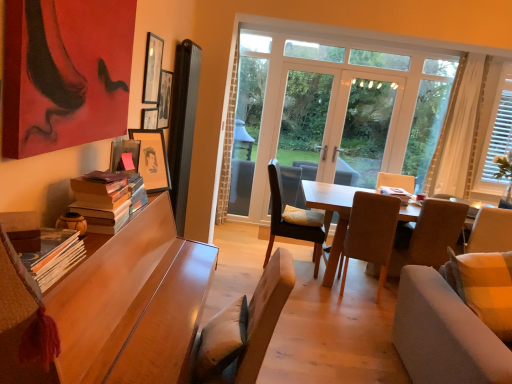
Question: Considering the relative positions of hardcover books at left, positioned as the third book in right-to-left order, and transparent glass door at center in the image provided, is hardcover books at left, positioned as the third book in right-to-left order, behind transparent glass door at center?

Choices:
 (A) no
 (B) yes

Answer: (A)

Question: From the image's perspective, would you say hardcover books at left, the 1th book from the left, is shown under transparent glass door at center?

Choices:
 (A) yes
 (B) no

Answer: (A)

Question: Is transparent glass door at center completely or partially inside hardcover books at left, positioned as the third book in right-to-left order?

Choices:
 (A) no
 (B) yes

Answer: (A)

Question: Does hardcover books at left, the 1th book from the left, have a greater height compared to transparent glass door at center?

Choices:
 (A) no
 (B) yes

Answer: (A)

Question: Is hardcover books at left, positioned as the third book in right-to-left order, wider than transparent glass door at center?

Choices:
 (A) yes
 (B) no

Answer: (A)

Question: From a real-world perspective, is transparent glass window at center, which appears as the first window when viewed from the left, physically located above or below light brown wooden table at center?

Choices:
 (A) above
 (B) below

Answer: (A)

Question: Is point (425, 102) closer or farther from the camera than point (369, 192)?

Choices:
 (A) closer
 (B) farther

Answer: (B)

Question: From the image's perspective, is transparent glass window at center, which appears as the first window when viewed from the left, positioned above or below light brown wooden table at center?

Choices:
 (A) above
 (B) below

Answer: (A)

Question: Is transparent glass window at center, which appears as the first window when viewed from the left, situated inside light brown wooden table at center or outside?

Choices:
 (A) inside
 (B) outside

Answer: (B)

Question: From their relative heights in the image, would you say hardcover book at center, the 3th book when ordered from front to back, is taller or shorter than matte black picture frame at upper left, the second picture frame from the back?

Choices:
 (A) tall
 (B) short

Answer: (B)

Question: Is point (386, 192) closer or farther from the camera than point (156, 54)?

Choices:
 (A) closer
 (B) farther

Answer: (B)

Question: Considering their positions, is hardcover book at center, the 3th book when ordered from front to back, located in front of or behind matte black picture frame at upper left, the second picture frame from the back?

Choices:
 (A) behind
 (B) front

Answer: (A)

Question: Is hardcover book at center, which is the first book from right to left, inside the boundaries of matte black picture frame at upper left, the 1th picture frame positioned from the top, or outside?

Choices:
 (A) inside
 (B) outside

Answer: (B)

Question: Considering the positions of point (185, 299) and point (463, 142), is point (185, 299) closer or farther from the camera than point (463, 142)?

Choices:
 (A) farther
 (B) closer

Answer: (B)

Question: From a real-world perspective, is wooden desk at left physically located above or below white sheer curtain at right?

Choices:
 (A) above
 (B) below

Answer: (B)